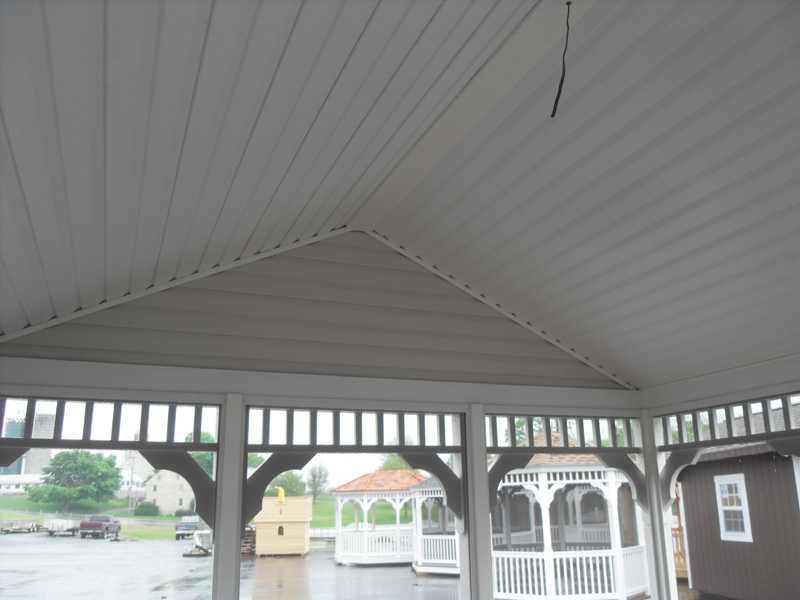
Identify the location of wet floor. (306, 579).